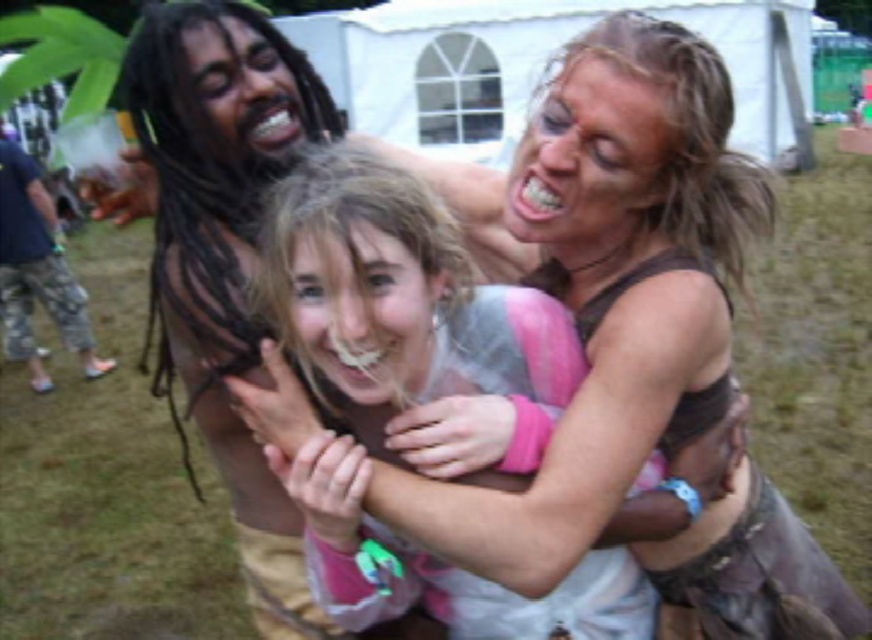
Is smooth skin face at center above dark brown hair at upper left?

Actually, smooth skin face at center is below dark brown hair at upper left.

I want to click on smooth skin face at center, so click(363, 312).

Which is in front, point (380, 280) or point (277, 64)?

Point (380, 280) is more forward.

The image size is (872, 640). What are the coordinates of `smooth skin face at center` in the screenshot? It's located at (363, 312).

Between point (582, 616) and point (537, 144), which one is positioned in front?

Positioned in front is point (537, 144).

Is the position of pink fabric at center less distant than that of blonde hair at upper right?

Yes, pink fabric at center is in front of blonde hair at upper right.

The image size is (872, 640). What do you see at coordinates (414, 390) in the screenshot?
I see `pink fabric at center` at bounding box center [414, 390].

Where is `pink fabric at center`? The height and width of the screenshot is (640, 872). pink fabric at center is located at coordinates (414, 390).

Does pink fabric at center have a lesser width compared to smooth skin face at center?

No, pink fabric at center is not thinner than smooth skin face at center.

Can you confirm if pink fabric at center is positioned to the left of smooth skin face at center?

No, pink fabric at center is not to the left of smooth skin face at center.

Locate an element on the screen. The width and height of the screenshot is (872, 640). pink fabric at center is located at coordinates (414, 390).